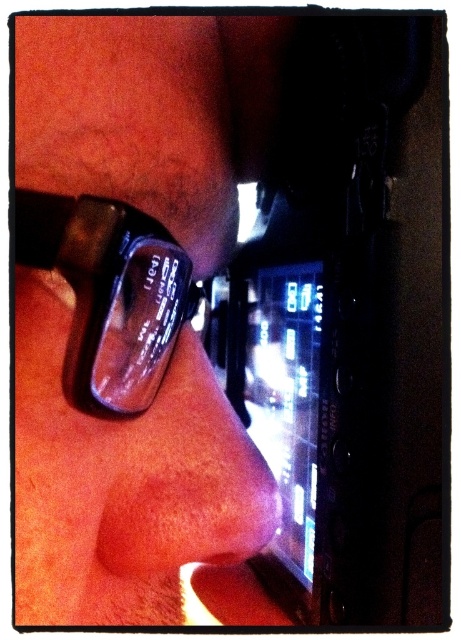
Measure the distance from matte black watch at lower left to transparent plastic glasses at upper left.

2.77 inches

Between point (141, 497) and point (83, 384), which one is positioned behind?

The point (141, 497) is more distant.

Identify the location of matte black watch at lower left. This screenshot has width=461, height=640. (122, 476).

Is matte black watch at lower left shorter than smooth skin nose at center?

Incorrect, matte black watch at lower left's height does not fall short of smooth skin nose at center's.

Is matte black watch at lower left below smooth skin nose at center?

No, matte black watch at lower left is not below smooth skin nose at center.

Who is more forward, (236,170) or (140,536)?

Point (140,536)

Identify the location of matte black watch at lower left. (122, 476).

Is the position of smooth skin nose at center more distant than that of transparent plastic glasses at upper left?

That is True.

Is point (194, 340) positioned behind point (149, 241)?

Yes.

The height and width of the screenshot is (640, 461). Identify the location of smooth skin nose at center. (188, 480).